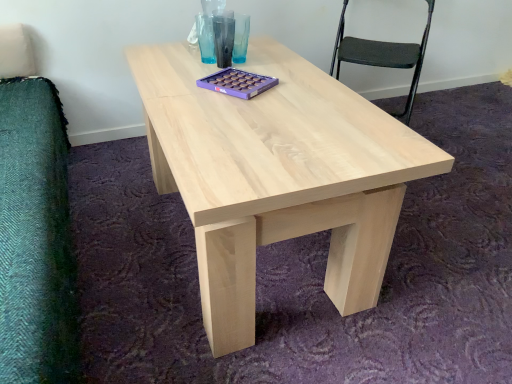
Where is `natural wood coffee table at center`? The width and height of the screenshot is (512, 384). natural wood coffee table at center is located at coordinates (277, 175).

Describe the element at coordinates (277, 175) in the screenshot. I see `natural wood coffee table at center` at that location.

Based on the photo, what is the approximate width of black fabric chair at upper right?

black fabric chair at upper right is 19.47 inches wide.

The image size is (512, 384). Identify the location of black fabric chair at upper right. (383, 55).

In order to face black fabric chair at upper right, should I rotate leftwards or rightwards?

To align with it, rotate right about 15.575°.

Image resolution: width=512 pixels, height=384 pixels. What do you see at coordinates (383, 55) in the screenshot?
I see `black fabric chair at upper right` at bounding box center [383, 55].

Where is `natural wood coffee table at center`? The height and width of the screenshot is (384, 512). natural wood coffee table at center is located at coordinates (277, 175).

Between natural wood coffee table at center and black fabric chair at upper right, which one appears on the right side from the viewer's perspective?

natural wood coffee table at center is more to the right.

Is the position of natural wood coffee table at center more distant than that of black fabric chair at upper right?

No, it is not.

Considering the positions of point (157, 69) and point (386, 43), is point (157, 69) closer or farther from the camera than point (386, 43)?

Clearly, point (157, 69) is closer to the camera than point (386, 43).

From the image's perspective, would you say natural wood coffee table at center is shown under black fabric chair at upper right?

Correct, natural wood coffee table at center appears lower than black fabric chair at upper right in the image.

From a real-world perspective, which object stands above the other?

From a 3D spatial view, black fabric chair at upper right is above.

Is natural wood coffee table at center wider than black fabric chair at upper right?

Correct, the width of natural wood coffee table at center exceeds that of black fabric chair at upper right.

Is natural wood coffee table at center taller than black fabric chair at upper right?

Incorrect, the height of natural wood coffee table at center is not larger of that of black fabric chair at upper right.

Is natural wood coffee table at center bigger or smaller than black fabric chair at upper right?

In the image, natural wood coffee table at center appears to be larger than black fabric chair at upper right.

Would you say natural wood coffee table at center contains black fabric chair at upper right?

Definitely not — black fabric chair at upper right is not inside natural wood coffee table at center.

Would you say natural wood coffee table at center is a long distance from black fabric chair at upper right?

Yes, natural wood coffee table at center and black fabric chair at upper right are quite far apart.

Is black fabric chair at upper right at the back of natural wood coffee table at center?

No, natural wood coffee table at center is not facing away from black fabric chair at upper right.

In the scene shown: What's the angular difference between natural wood coffee table at center and black fabric chair at upper right's facing directions?

natural wood coffee table at center and black fabric chair at upper right are facing 128 degrees away from each other.

The height and width of the screenshot is (384, 512). I want to click on chair on the left of natural wood coffee table at center, so click(383, 55).

Which object is positioned more to the right, black fabric chair at upper right or natural wood coffee table at center?

From the viewer's perspective, natural wood coffee table at center appears more on the right side.

Is the position of black fabric chair at upper right more distant than that of natural wood coffee table at center?

Yes, it is behind natural wood coffee table at center.

Does point (362, 42) appear closer or farther from the camera than point (360, 225)?

Point (362, 42) appears to be farther away from the viewer than point (360, 225).

From the image's perspective, between black fabric chair at upper right and natural wood coffee table at center, who is located below?

natural wood coffee table at center, from the image's perspective.

From a real-world perspective, is black fabric chair at upper right physically located above or below natural wood coffee table at center?

From a real-world perspective, black fabric chair at upper right is physically above natural wood coffee table at center.

Is black fabric chair at upper right thinner than natural wood coffee table at center?

Yes.

Is black fabric chair at upper right taller or shorter than natural wood coffee table at center?

black fabric chair at upper right is taller than natural wood coffee table at center.

Is black fabric chair at upper right smaller than natural wood coffee table at center?

Yes, black fabric chair at upper right is smaller than natural wood coffee table at center.

Is black fabric chair at upper right not inside natural wood coffee table at center?

Yes.

Is black fabric chair at upper right not close to natural wood coffee table at center?

black fabric chair at upper right is far away from natural wood coffee table at center.

From the picture: Could you tell me if black fabric chair at upper right is turned towards natural wood coffee table at center?

Yes, black fabric chair at upper right is turned towards natural wood coffee table at center.

What's the angular difference between black fabric chair at upper right and natural wood coffee table at center's facing directions?

There is a 128-degree angle between the facing directions of black fabric chair at upper right and natural wood coffee table at center.

Identify the location of chair above the natural wood coffee table at center (from the image's perspective). (383, 55).

The image size is (512, 384). Find the location of `coffee table below the black fabric chair at upper right (from the image's perspective)`. coffee table below the black fabric chair at upper right (from the image's perspective) is located at coordinates (277, 175).

Where is `coffee table located underneath the black fabric chair at upper right (from a real-world perspective)`? This screenshot has width=512, height=384. coffee table located underneath the black fabric chair at upper right (from a real-world perspective) is located at coordinates (277, 175).